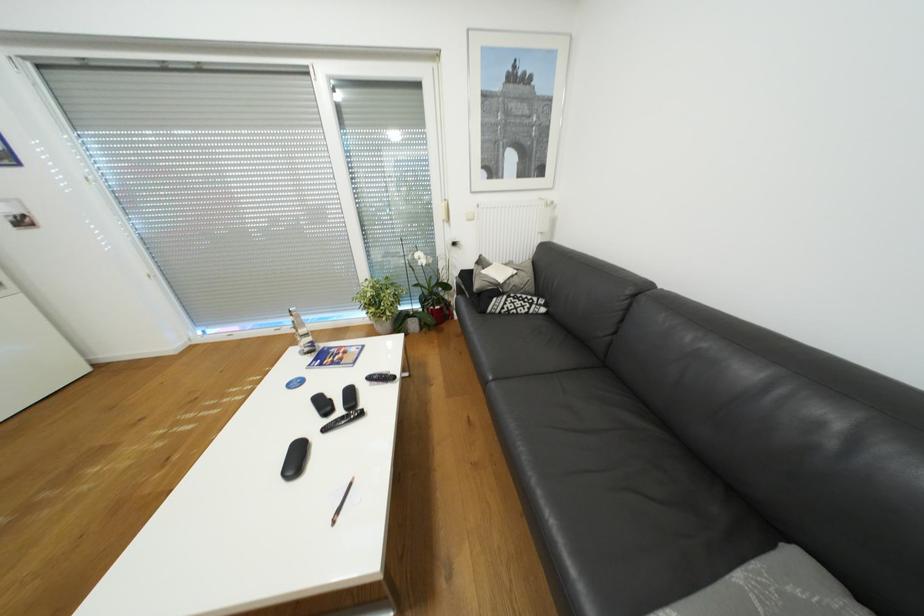
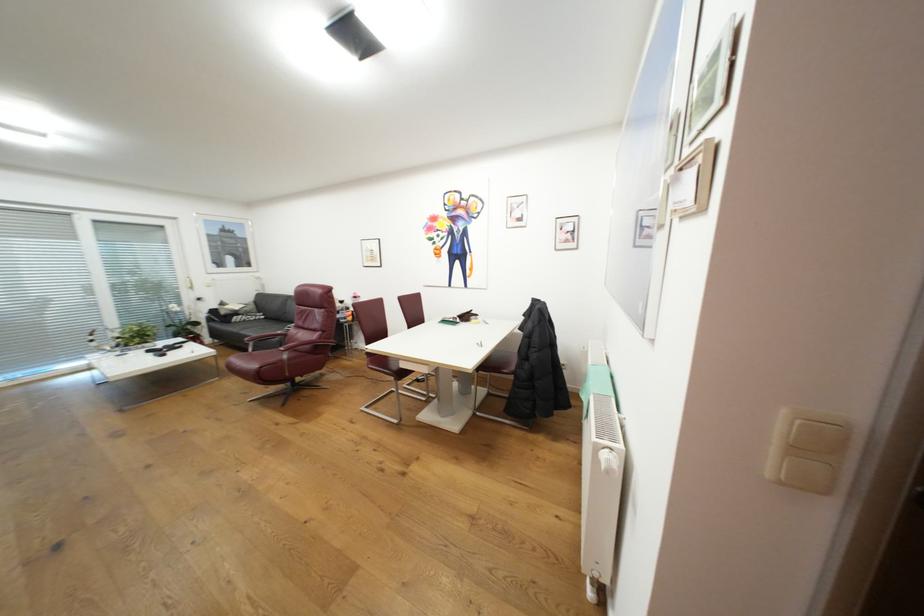
Find the pixel in the second image that matches the point at 503,305 in the first image.

(244, 318)